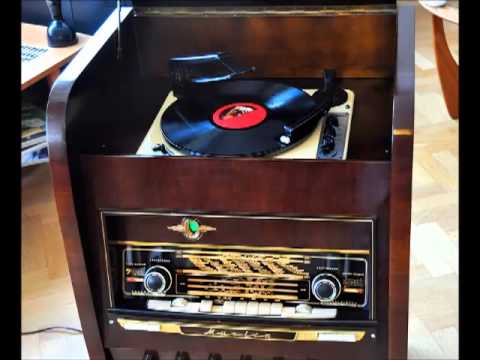
You are a GUI agent. You are given a task and a screenshot of the screen. Output one action in this format:
    pyautogui.click(x=<x>, y=<y>)
    Task: Click on the cable
    The height and width of the screenshot is (360, 480).
    Given the screenshot: What is the action you would take?
    pyautogui.click(x=42, y=331)